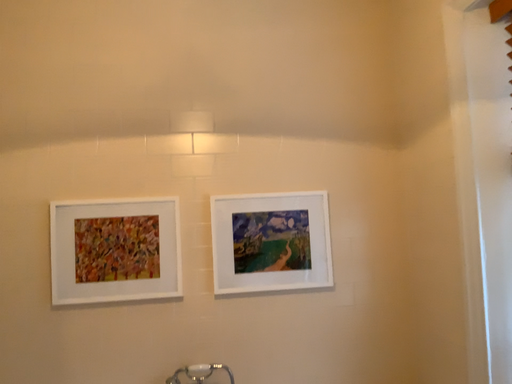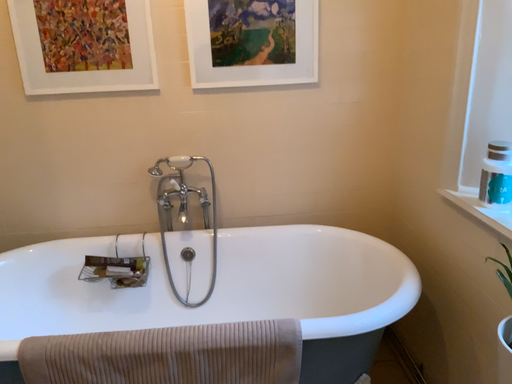
Question: How did the camera likely rotate when shooting the video?

Choices:
 (A) rotated downward
 (B) rotated upward

Answer: (A)